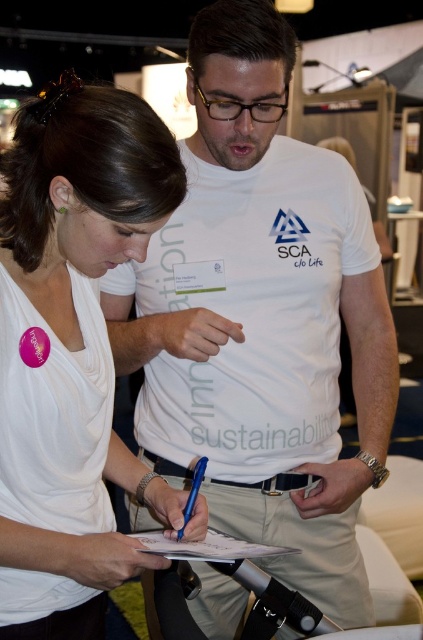
You are standing at the origin of the coordinate system in the image. There are two points marked in the scene. Which point is closer to you, point (220, 532) or point (197, 477)?

Point (197, 477) is closer to you because it is in front of point (220, 532).

You are organizing a workshop and need to ensure that the blue metallic pen at center can be used to write on the white paper at center. Based on their positions, is the pen currently in a position to write on the paper?

The white paper at center is positioned under the blue metallic pen at center, so yes, the pen is in a position to write on the paper.